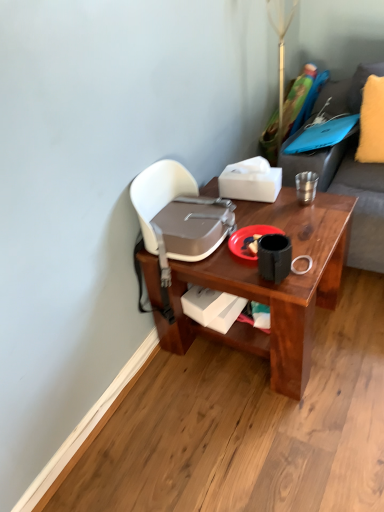
Identify the location of free space to the left of metallic silver coffee cup at upper right. The width and height of the screenshot is (384, 512). (269, 209).